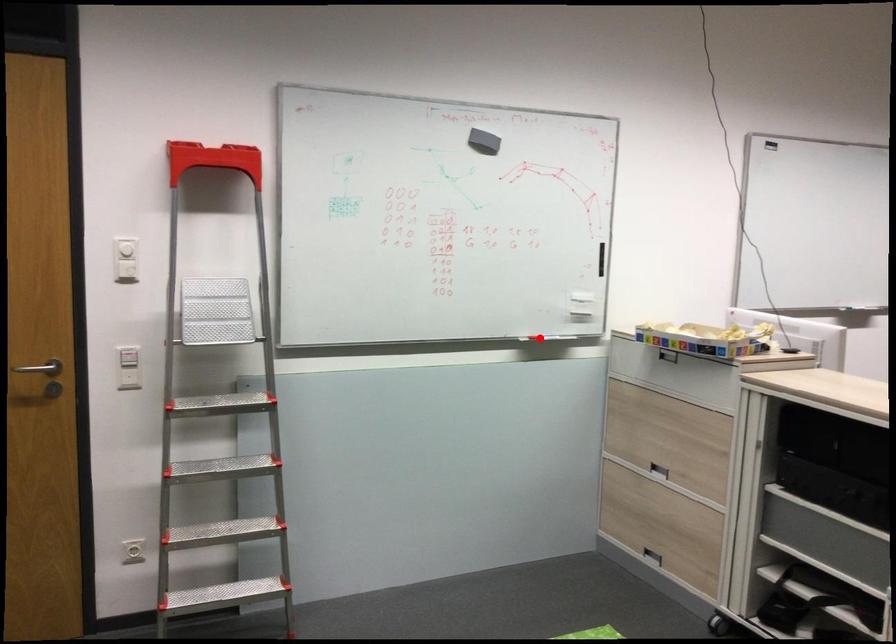
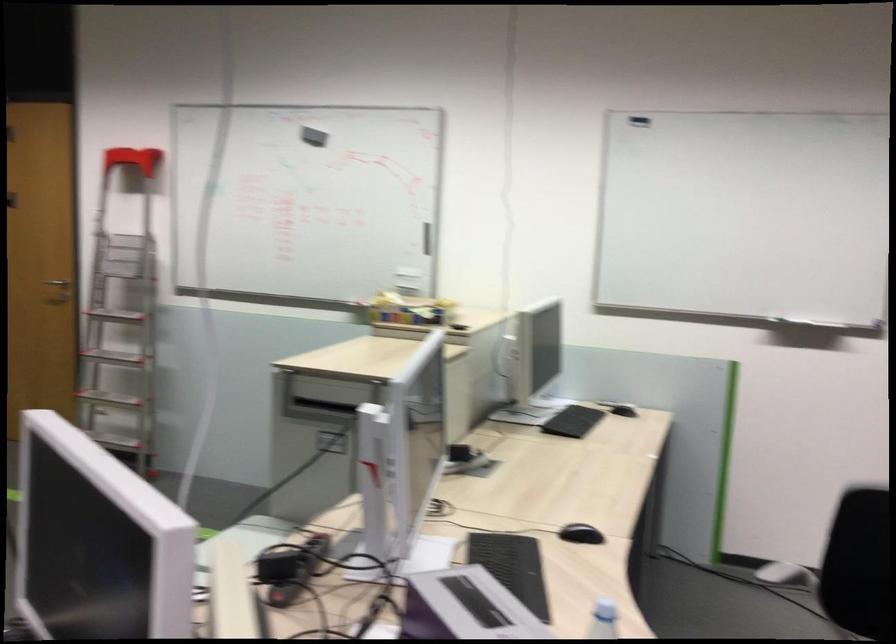
Question: I am providing you with two images of the same scene from different viewpoints. A red point is marked on the first image. Is the red point's position out of view in image 2?

Choices:
 (A) Yes
 (B) No

Answer: (A)